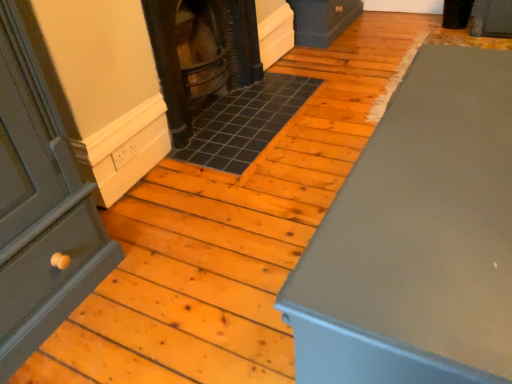
What do you see at coordinates (417, 238) in the screenshot? I see `matte gray cabinet at right` at bounding box center [417, 238].

Image resolution: width=512 pixels, height=384 pixels. Identify the location of matte gray cabinet at right. (417, 238).

What do you see at coordinates (201, 54) in the screenshot?
I see `dark brown wood stove at center` at bounding box center [201, 54].

Where is `dark brown wood stove at center`? The image size is (512, 384). dark brown wood stove at center is located at coordinates (201, 54).

In order to face dark brown wood stove at center, should I rotate leftwards or rightwards?

Rotate your view left by about 7.761°.

Measure the distance between point [243,0] and camera.

The depth of point [243,0] is 2.39 meters.

The width and height of the screenshot is (512, 384). I want to click on matte gray cabinet at right, so click(417, 238).

Would you say matte gray cabinet at right is to the left or to the right of dark brown wood stove at center in the picture?

Clearly, matte gray cabinet at right is on the right of dark brown wood stove at center in the image.

Which object is further away from the camera taking this photo, matte gray cabinet at right or dark brown wood stove at center?

dark brown wood stove at center is behind.

Is point (306, 287) closer to viewer compared to point (154, 49)?

Yes.

From the image's perspective, is matte gray cabinet at right located above dark brown wood stove at center?

Incorrect, from the image's perspective, matte gray cabinet at right is lower than dark brown wood stove at center.

Consider the image. From a real-world perspective, is matte gray cabinet at right positioned under dark brown wood stove at center based on gravity?

Yes.

Is matte gray cabinet at right wider or thinner than dark brown wood stove at center?

matte gray cabinet at right is wider than dark brown wood stove at center.

Is matte gray cabinet at right taller than dark brown wood stove at center?

Incorrect, the height of matte gray cabinet at right is not larger of that of dark brown wood stove at center.

Who is smaller, matte gray cabinet at right or dark brown wood stove at center?

dark brown wood stove at center is smaller.

Is matte gray cabinet at right inside or outside of dark brown wood stove at center?

matte gray cabinet at right lies outside dark brown wood stove at center.

Are matte gray cabinet at right and dark brown wood stove at center beside each other?

They are not placed beside each other.

From the picture: Is matte gray cabinet at right looking in the opposite direction of dark brown wood stove at center?

No, matte gray cabinet at right's orientation is not away from dark brown wood stove at center.

Locate an element on the screen. This screenshot has width=512, height=384. furniture located in front of the dark brown wood stove at center is located at coordinates (417, 238).

Is dark brown wood stove at center to the right of matte gray cabinet at right from the viewer's perspective?

Incorrect, dark brown wood stove at center is not on the right side of matte gray cabinet at right.

Who is more distant, dark brown wood stove at center or matte gray cabinet at right?

Positioned behind is dark brown wood stove at center.

Does point (248, 71) appear closer or farther from the camera than point (370, 379)?

Point (248, 71) is positioned farther from the camera compared to point (370, 379).

From the image's perspective, which is above, dark brown wood stove at center or matte gray cabinet at right?

dark brown wood stove at center appears higher in the image.

From a real-world perspective, which object stands above the other?

dark brown wood stove at center.

Between dark brown wood stove at center and matte gray cabinet at right, which one has smaller width?

dark brown wood stove at center is thinner.

Between dark brown wood stove at center and matte gray cabinet at right, which one has less height?

matte gray cabinet at right.

Considering the relative sizes of dark brown wood stove at center and matte gray cabinet at right in the image provided, is dark brown wood stove at center smaller than matte gray cabinet at right?

Indeed, dark brown wood stove at center has a smaller size compared to matte gray cabinet at right.

Is dark brown wood stove at center located outside matte gray cabinet at right?

Yes, dark brown wood stove at center is located beyond the bounds of matte gray cabinet at right.

Based on the photo, does dark brown wood stove at center touch matte gray cabinet at right?

No.

Could you tell me if dark brown wood stove at center is facing matte gray cabinet at right?

Yes, dark brown wood stove at center is oriented towards matte gray cabinet at right.

Locate an element on the screen. stove behind the matte gray cabinet at right is located at coordinates (201, 54).

The image size is (512, 384). In the image, there is a dark brown wood stove at center. Find the location of `furniture below it (from a real-world perspective)`. furniture below it (from a real-world perspective) is located at coordinates (417, 238).

Locate an element on the screen. The width and height of the screenshot is (512, 384). stove on the left of matte gray cabinet at right is located at coordinates (201, 54).